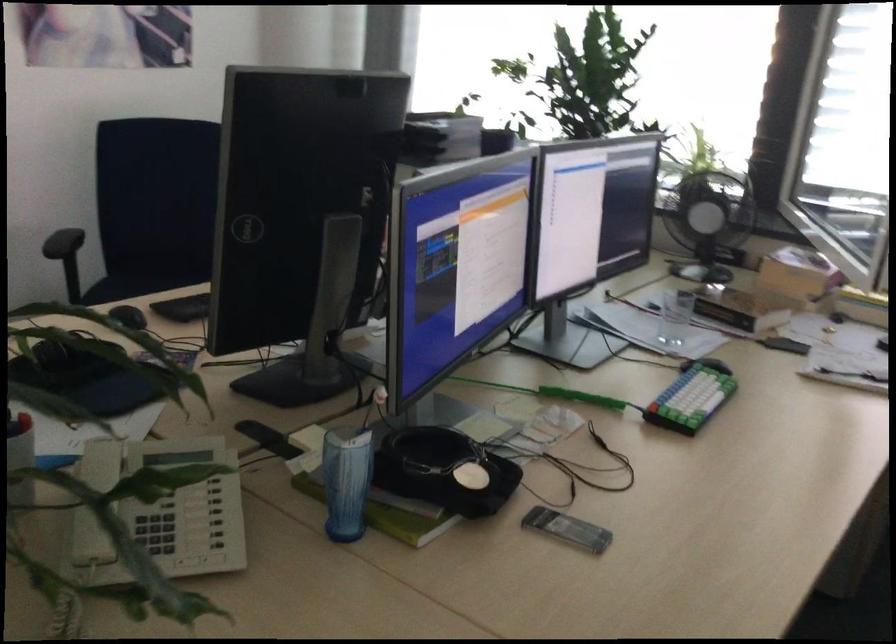
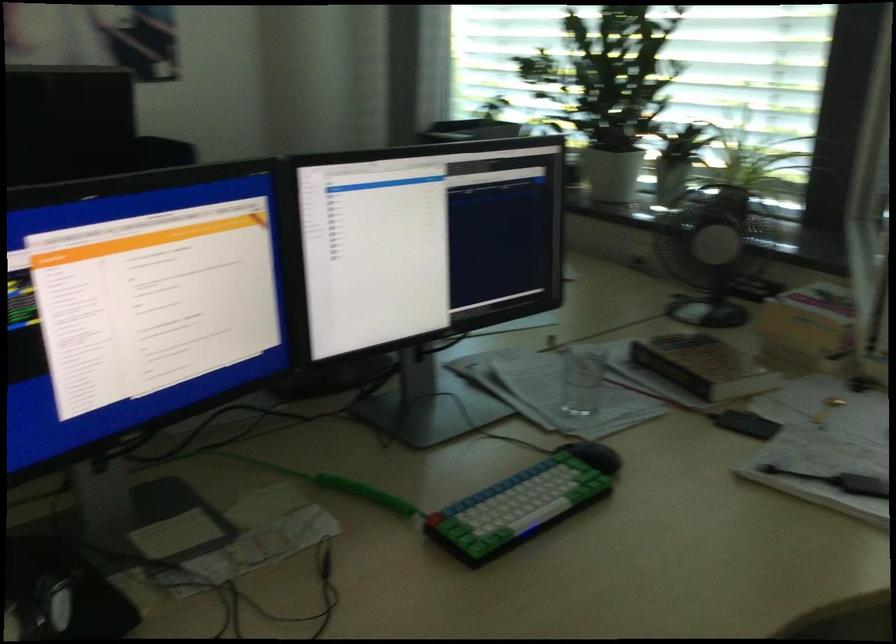
Find the pixel in the second image that matches point 750,303 in the first image.

(703, 366)